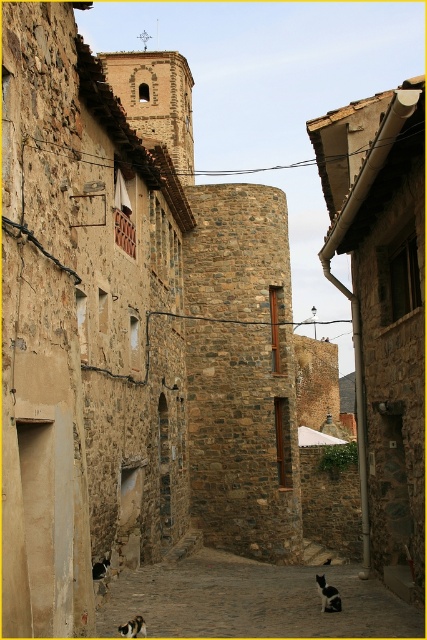
Question: Which point is farther to the camera?

Choices:
 (A) black fur cat at lower center
 (B) calico fur cat at lower center

Answer: (A)

Question: Does brown stone alley at center appear under calico fur cat at lower center?

Choices:
 (A) yes
 (B) no

Answer: (A)

Question: Considering the real-world distances, which object is farthest from the calico fur cat at lower center?

Choices:
 (A) brown stone alley at center
 (B) black fur cat at lower center

Answer: (A)

Question: Which object is positioned farthest from the brown stone alley at center?

Choices:
 (A) black fur cat at lower center
 (B) calico fur cat at lower center

Answer: (B)

Question: Does black fur cat at lower center appear on the right side of calico fur cat at lower center?

Choices:
 (A) no
 (B) yes

Answer: (B)

Question: Is brown stone alley at center closer to camera compared to black fur cat at lower center?

Choices:
 (A) no
 (B) yes

Answer: (B)